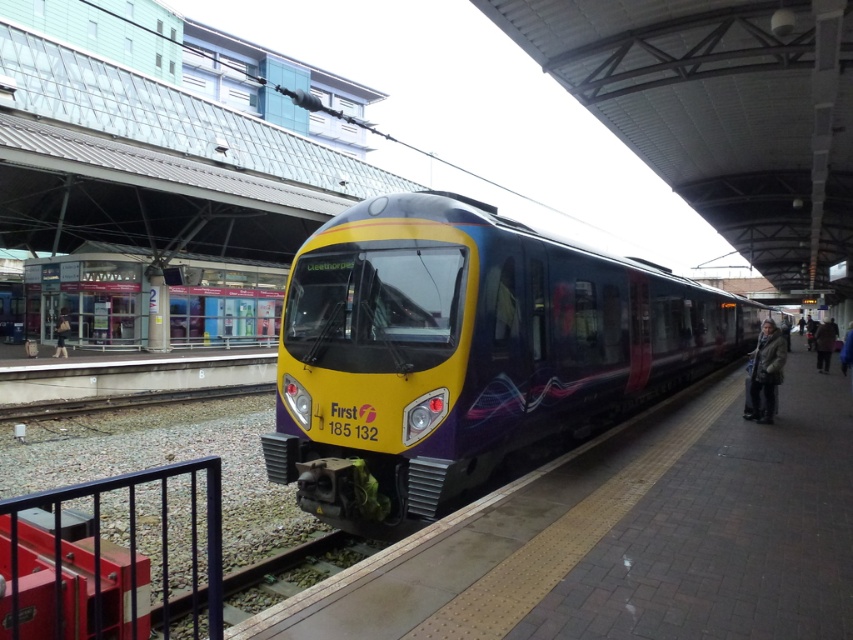
Based on the photo, you are a photographer standing at the train station. You want to take a photo of the yellow matte train at center. If your camera can capture objects up to 25 meters away, will the train be in focus?

The yellow matte train at center is 23.66 meters from camera, which is within the camera range of 25 meters. Therefore, the train will be in focus.

You are a passenger waiting at the train station platform. You see a brown woolen coat at right and a blue fabric jacket at right. Which one is smaller in size?

The brown woolen coat at right is smaller than the blue fabric jacket at right.